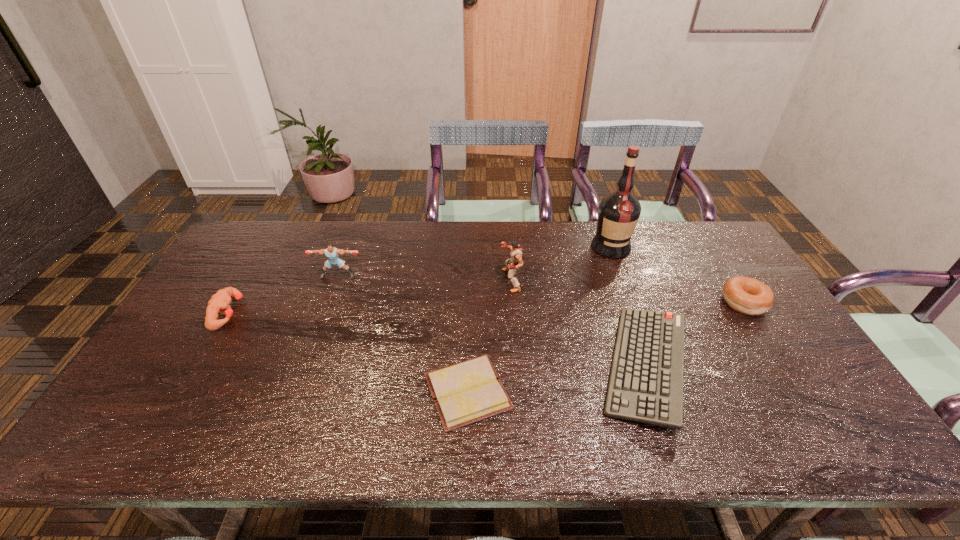
Find the location of a particular element. This screenshot has height=540, width=960. vacant space at the far right corner is located at coordinates (735, 258).

Where is `free spot at the near right corner of the desktop`? free spot at the near right corner of the desktop is located at coordinates tap(858, 446).

Locate an element on the screen. The image size is (960, 540). unoccupied area between the computer keyboard and the second tallest object is located at coordinates (578, 324).

The height and width of the screenshot is (540, 960). Identify the location of empty location between the fifth shortest object and the tallest puncher. (424, 278).

At what (x,y) coordinates should I click in order to perform the action: click on free area in between the diary and the tallest object. Please return your answer as a coordinate pair (x, y). This screenshot has width=960, height=540. Looking at the image, I should click on (540, 319).

Where is `empty location between the computer keyboard and the liquor`? empty location between the computer keyboard and the liquor is located at coordinates (628, 307).

I want to click on empty location between the computer keyboard and the diary, so (x=557, y=380).

This screenshot has width=960, height=540. In order to click on vacant region between the second shortest puncher and the computer keyboard in this screenshot , I will do `click(492, 322)`.

Locate an element on the screen. free space between the second tallest object and the shortest puncher is located at coordinates (370, 296).

Where is `unoccupied position between the computer keyboard and the tallest puncher`? The image size is (960, 540). unoccupied position between the computer keyboard and the tallest puncher is located at coordinates (578, 324).